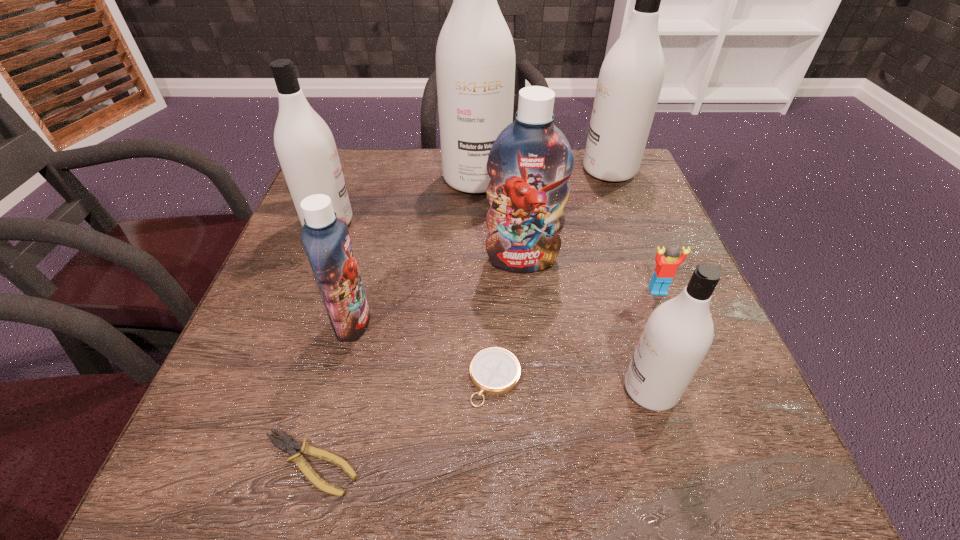
At what (x,y) coordinates should I click in order to perform the action: click on the nearest white shampoo. Please return your answer as a coordinate pair (x, y). The image size is (960, 540). Looking at the image, I should click on (678, 334).

Locate an element on the screen. the nearest shampoo is located at coordinates (678, 334).

Identify the location of red Lego. This screenshot has width=960, height=540. (665, 270).

You are a GUI agent. You are given a task and a screenshot of the screen. Output one action in this format:
    pyautogui.click(x=<x>, y=<y>)
    Task: Click on the Lego
    The height and width of the screenshot is (540, 960).
    Given the screenshot: What is the action you would take?
    pyautogui.click(x=665, y=270)

Identify the location of the eighth tallest object. The image size is (960, 540). (495, 371).

At what (x,y) coordinates should I click in order to perform the action: click on pliers. Please return your answer as a coordinate pair (x, y). The image size is (960, 540). Looking at the image, I should click on (290, 445).

You are a GUI agent. You are given a task and a screenshot of the screen. Output one action in this format:
    pyautogui.click(x=<x>, y=<y>)
    Task: Click on the shortest object
    The width and height of the screenshot is (960, 540).
    Given the screenshot: What is the action you would take?
    pyautogui.click(x=290, y=445)

Locate an element on the screen. This screenshot has width=960, height=540. free spot located 0.250m on the front-facing side of the biggest white shampoo is located at coordinates (475, 268).

Identify the location of free space located 0.220m on the front-facing side of the third smallest white shampoo. The image size is (960, 540). (501, 171).

Identify the location of free space located 0.110m on the front-facing side of the third smallest white shampoo. coord(541,171).